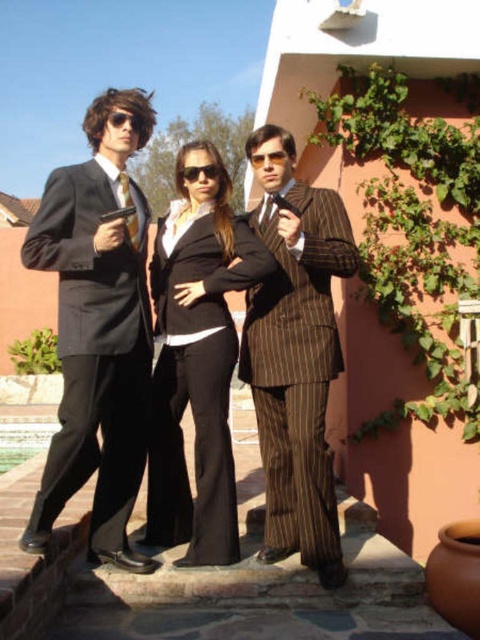
Which is more to the left, gold pinstripe suit at center or black plastic sunglasses at center?

Positioned to the left is black plastic sunglasses at center.

Which is behind, point (310, 323) or point (204, 173)?

Positioned behind is point (204, 173).

At what (x,y) coordinates should I click in order to perform the action: click on gold pinstripe suit at center. Please return your answer as a coordinate pair (x, y). The image size is (480, 640). Looking at the image, I should click on (296, 355).

Is black plastic sunglasses at center further to the viewer compared to pinstriped fabric tie at center?

That is False.

In the scene shown: Is black plastic sunglasses at center to the right of pinstriped fabric tie at center from the viewer's perspective?

No, black plastic sunglasses at center is not to the right of pinstriped fabric tie at center.

This screenshot has height=640, width=480. Describe the element at coordinates (199, 172) in the screenshot. I see `black plastic sunglasses at center` at that location.

The height and width of the screenshot is (640, 480). I want to click on black plastic sunglasses at center, so click(x=199, y=172).

Can you confirm if matte black suit at left is shorter than gold pinstripe suit at center?

Incorrect, matte black suit at left's height does not fall short of gold pinstripe suit at center's.

Is matte black suit at left below gold pinstripe suit at center?

Incorrect, matte black suit at left is not positioned below gold pinstripe suit at center.

Which is behind, point (141, 221) or point (294, 481)?

Point (141, 221)

You are a GUI agent. You are given a task and a screenshot of the screen. Output one action in this format:
    pyautogui.click(x=<x>, y=<y>)
    Task: Click on the matte black suit at left
    
    Given the screenshot: What is the action you would take?
    pyautogui.click(x=96, y=328)